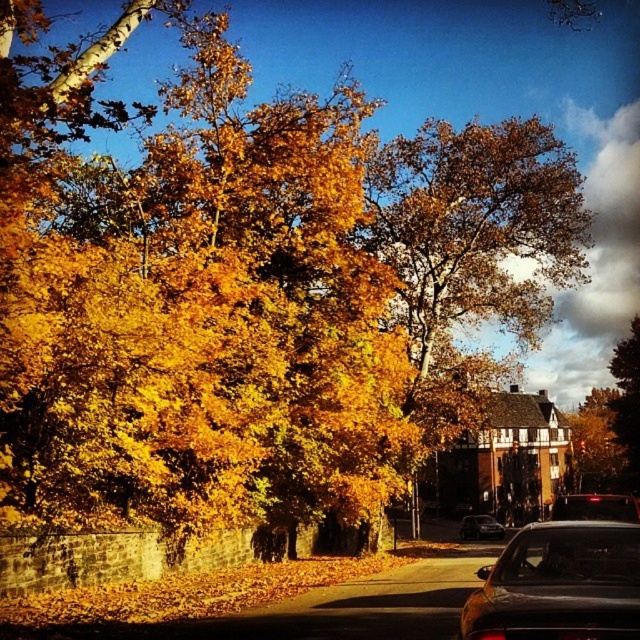
Question: Does golden leafy tree at center appear over black glossy car at center?

Choices:
 (A) yes
 (B) no

Answer: (A)

Question: Does black glossy car at center appear under satin black sedan at center?

Choices:
 (A) no
 (B) yes

Answer: (A)

Question: Which object appears farthest from the camera in this image?

Choices:
 (A) black glossy car at center
 (B) shiny black sedan at lower right

Answer: (A)

Question: Can you confirm if golden leafy tree at center is positioned above black glossy car at center?

Choices:
 (A) yes
 (B) no

Answer: (A)

Question: Among these objects, which one is nearest to the camera?

Choices:
 (A) shiny black sedan at lower right
 (B) satin black sedan at center

Answer: (A)

Question: Estimate the real-world distances between objects in this image. Which object is closer to the black glossy car at center?

Choices:
 (A) shiny black sedan at lower right
 (B) satin black sedan at center

Answer: (B)